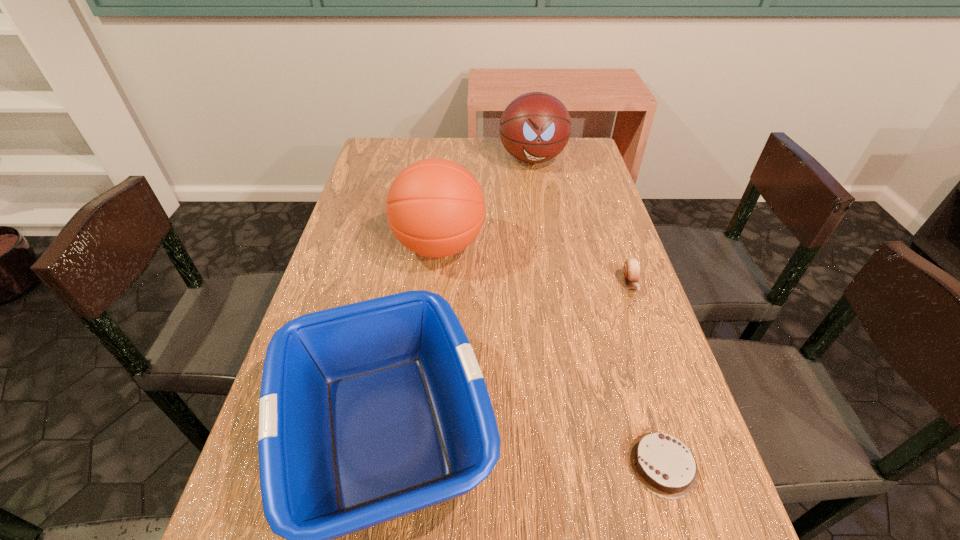
Locate an element on the screen. object that is at the left edge is located at coordinates (435, 207).

At what (x,y) coordinates should I click in order to perform the action: click on basketball located at the right edge. Please return your answer as a coordinate pair (x, y). Image resolution: width=960 pixels, height=540 pixels. Looking at the image, I should click on (535, 127).

Find the location of a particular element. The width and height of the screenshot is (960, 540). escargot positioned at the right edge is located at coordinates (631, 268).

The image size is (960, 540). I want to click on chocolate cake present at the right edge, so click(x=662, y=464).

At what (x,y) coordinates should I click in order to perform the action: click on object that is positioned at the far right corner. Please return your answer as a coordinate pair (x, y). Looking at the image, I should click on (535, 127).

In the image, there is a desktop. What are the coordinates of `blank space at the far edge` in the screenshot? It's located at (464, 140).

In the image, there is a desktop. Where is `vacant space at the left edge`? The width and height of the screenshot is (960, 540). vacant space at the left edge is located at coordinates (382, 275).

Where is `vacant region at the right edge of the desktop`? This screenshot has width=960, height=540. vacant region at the right edge of the desktop is located at coordinates click(x=572, y=247).

Find the location of `vacant space at the far right corner`. vacant space at the far right corner is located at coordinates (582, 144).

Where is `vacant point located between the farther basketball and the escargot`? The height and width of the screenshot is (540, 960). vacant point located between the farther basketball and the escargot is located at coordinates (582, 221).